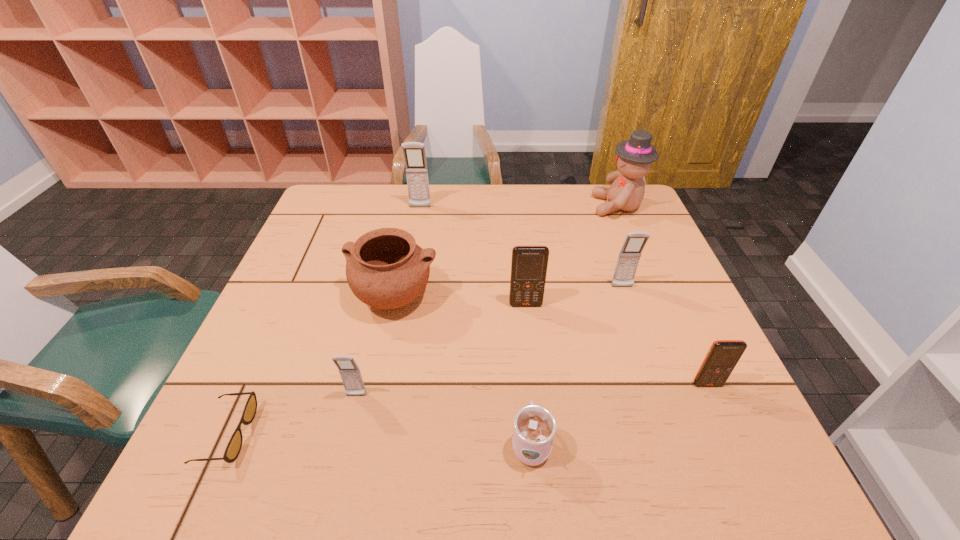
Locate which cellular telephone is the closest to the cup. Please provide its 2D coordinates. Your answer should be formatted as a tuple, i.e. [(x, y)], where the tuple contains the x and y coordinates of a point satisfying the conditions above.

[(350, 373)]

What are the coordinates of `cellular telephone that can be found as the closest to the cup` in the screenshot? It's located at (350, 373).

Identify which gray cellular telephone is located as the second nearest to the second cellular telephone from left to right. Please provide its 2D coordinates. Your answer should be formatted as a tuple, i.e. [(x, y)], where the tuple contains the x and y coordinates of a point satisfying the conditions above.

[(350, 373)]

The image size is (960, 540). I want to click on gray cellular telephone that is the second closest to the shortest object, so click(x=414, y=154).

Identify the location of vacant region that satisfies the following two spatial constraints: 1. on the front-facing side of the sunglasses; 2. on the side with the handle of the second shortest object. (223, 444).

Find the location of `free space that satisfies the following two spatial constraints: 1. on the front-facing side of the rag_doll; 2. on the front side of the terracotta pottery`. free space that satisfies the following two spatial constraints: 1. on the front-facing side of the rag_doll; 2. on the front side of the terracotta pottery is located at coordinates (656, 298).

Identify the location of vacant area that satisfies the following two spatial constraints: 1. on the front-facing side of the black sunglasses; 2. on the side with the handle of the cup. (223, 444).

The height and width of the screenshot is (540, 960). In order to click on blank area in the image that satisfies the following two spatial constraints: 1. on the side with the handle of the cup; 2. on the front-facing side of the leftmost object in this screenshot , I will do `click(530, 434)`.

Find the location of a particular element. Image resolution: width=960 pixels, height=540 pixels. free space that satisfies the following two spatial constraints: 1. on the front-facing side of the rag_doll; 2. on the front-facing side of the leftmost gray cellular telephone is located at coordinates (697, 396).

I want to click on vacant position in the image that satisfies the following two spatial constraints: 1. on the screen of the rightmost cellular telephone; 2. on the front-facing side of the shortest object, so click(730, 434).